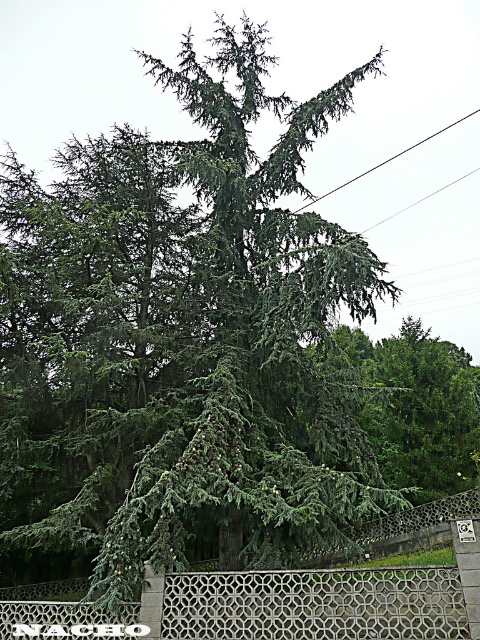
Question: Is white textured fence at lower center smaller than black wire at upper center?

Choices:
 (A) no
 (B) yes

Answer: (B)

Question: Which of the following is the farthest from the observer?

Choices:
 (A) (222, 576)
 (B) (358, 173)

Answer: (B)

Question: Can you confirm if white textured fence at lower center is positioned to the left of black wire at upper center?

Choices:
 (A) no
 (B) yes

Answer: (B)

Question: Does white textured fence at lower center have a smaller size compared to black wire at upper center?

Choices:
 (A) no
 (B) yes

Answer: (B)